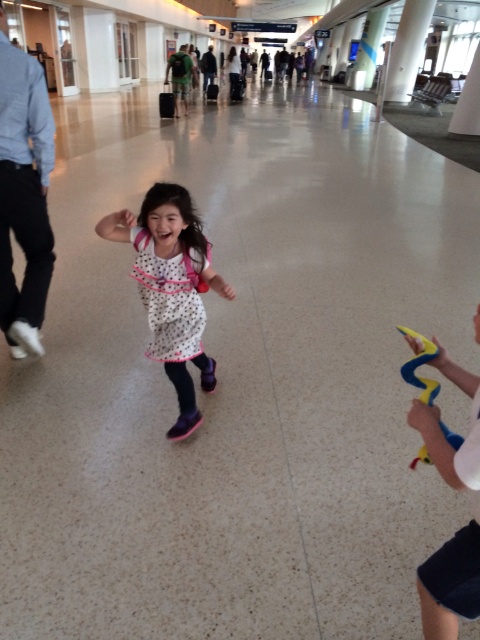
Question: Considering the real-world distances, which object is closest to the green fabric backpack at upper center?

Choices:
 (A) dark blue jeans at center
 (B) white dotted dress at center
 (C) light blue shirt at left
 (D) yellow rubber snake at right

Answer: (A)

Question: Which point is farther from the camera taking this photo?

Choices:
 (A) (205, 61)
 (B) (172, 86)

Answer: (A)

Question: Among these points, which one is nearest to the camera?

Choices:
 (A) (187, 100)
 (B) (176, 262)
 (C) (410, 362)

Answer: (C)

Question: Is light blue shirt at left further to camera compared to green fabric backpack at upper center?

Choices:
 (A) yes
 (B) no

Answer: (B)

Question: Is green fabric backpack at upper center positioned before dark blue jeans at center?

Choices:
 (A) no
 (B) yes

Answer: (B)

Question: Does white dotted dress at center lie behind green fabric backpack at upper center?

Choices:
 (A) yes
 (B) no

Answer: (B)